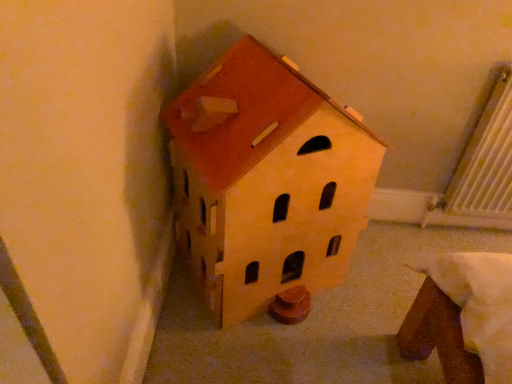
What are the coordinates of `free location to the right of matte wood house at center` in the screenshot? It's located at (378, 287).